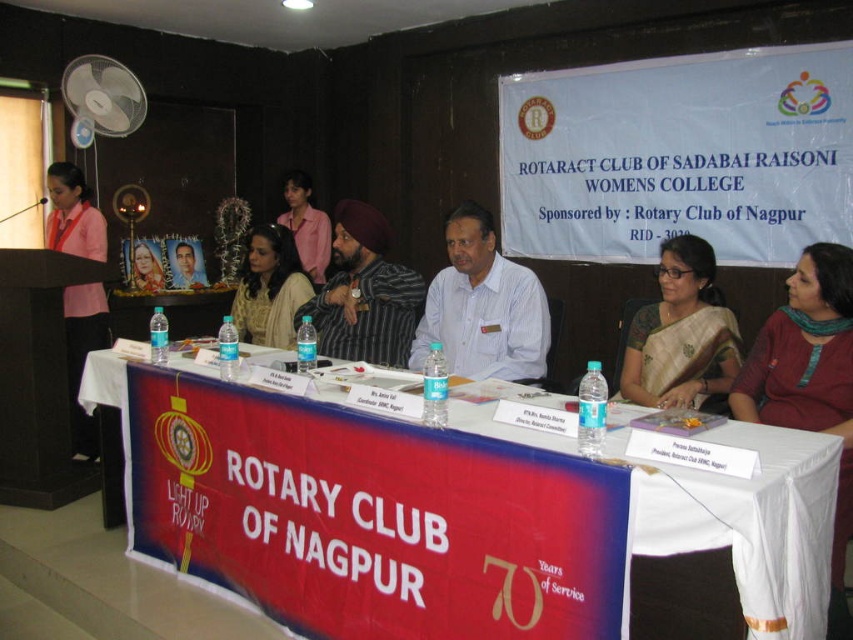
You are a photographer at the event and need to capture both the golden silk saree at center and the pink satin shirt at upper center in a single frame. Considering their sizes, which one might require more space in the composition?

The golden silk saree at center requires more space in the composition because its width is larger than the pink satin shirt at upper center.